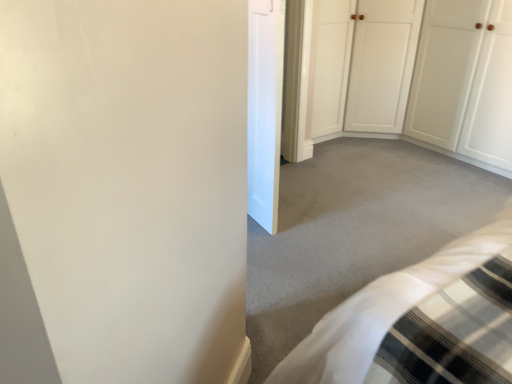
The image size is (512, 384). What do you see at coordinates (265, 109) in the screenshot?
I see `white smooth door at center, which is the second door in right-to-left order` at bounding box center [265, 109].

What is the approximate height of white smooth door at center, which is counted as the first door, starting from the front?

white smooth door at center, which is counted as the first door, starting from the front, is 1.22 meters tall.

You are a GUI agent. You are given a task and a screenshot of the screen. Output one action in this format:
    pyautogui.click(x=<x>, y=<y>)
    Task: Click on the white smooth door at center, the first door when ordered from left to right
    The image size is (512, 384).
    Given the screenshot: What is the action you would take?
    pyautogui.click(x=265, y=109)

Identify the location of white wood door at upper right, which is the first door in right-to-left order. The width and height of the screenshot is (512, 384). (464, 80).

This screenshot has width=512, height=384. What do you see at coordinates (464, 80) in the screenshot?
I see `white wood door at upper right, which is the first door in right-to-left order` at bounding box center [464, 80].

Identify the location of white smooth door at center, the 2th door from the back. Image resolution: width=512 pixels, height=384 pixels. (265, 109).

Visually, is white smooth door at center, which is the second door in right-to-left order, positioned to the left or to the right of white wood door at upper right, the 2th door positioned from the left?

white smooth door at center, which is the second door in right-to-left order, is to the left of white wood door at upper right, the 2th door positioned from the left.

Is white smooth door at center, which is counted as the first door, starting from the front, further to camera compared to white wood door at upper right, which is the first door in right-to-left order?

No, white smooth door at center, which is counted as the first door, starting from the front, is in front of white wood door at upper right, which is the first door in right-to-left order.

Which is in front, point (276, 131) or point (490, 111)?

The point (276, 131) is in front.

From the image's perspective, is white smooth door at center, the first door when ordered from left to right, located above or below white wood door at upper right, which appears as the 2th door when viewed from the front?

Clearly, from the image's perspective, white smooth door at center, the first door when ordered from left to right, is below white wood door at upper right, which appears as the 2th door when viewed from the front.

From a real-world perspective, is white smooth door at center, the first door when ordered from left to right, physically below white wood door at upper right, the 2th door positioned from the left?

No, from a real-world perspective, white smooth door at center, the first door when ordered from left to right, is not under white wood door at upper right, the 2th door positioned from the left.

Considering the sizes of objects white smooth door at center, the first door when ordered from left to right, and white wood door at upper right, the 2th door positioned from the left, in the image provided, who is wider, white smooth door at center, the first door when ordered from left to right, or white wood door at upper right, the 2th door positioned from the left,?

Result: white wood door at upper right, the 2th door positioned from the left, is wider.

Considering the sizes of white smooth door at center, the 2th door from the back, and white wood door at upper right, acting as the 1th door starting from the back, in the image, is white smooth door at center, the 2th door from the back, taller or shorter than white wood door at upper right, acting as the 1th door starting from the back,?

Clearly, white smooth door at center, the 2th door from the back, is taller compared to white wood door at upper right, acting as the 1th door starting from the back.

Is white smooth door at center, the 2th door from the back, bigger than white wood door at upper right, acting as the 1th door starting from the back?

Actually, white smooth door at center, the 2th door from the back, might be smaller than white wood door at upper right, acting as the 1th door starting from the back.

Is white smooth door at center, which is counted as the first door, starting from the front, not within white wood door at upper right, which is the first door in right-to-left order?

Yes, white smooth door at center, which is counted as the first door, starting from the front, is outside of white wood door at upper right, which is the first door in right-to-left order.

Is white smooth door at center, which is the second door in right-to-left order, touching white wood door at upper right, acting as the 1th door starting from the back?

white smooth door at center, which is the second door in right-to-left order, and white wood door at upper right, acting as the 1th door starting from the back, are not in contact.

Is white smooth door at center, which is the second door in right-to-left order, facing towards white wood door at upper right, which appears as the 2th door when viewed from the front?

Yes, white smooth door at center, which is the second door in right-to-left order, is facing white wood door at upper right, which appears as the 2th door when viewed from the front.

What are the coordinates of `door in front of the white wood door at upper right, the 2th door positioned from the left` in the screenshot? It's located at (265, 109).

Between white wood door at upper right, acting as the 1th door starting from the back, and white smooth door at center, which is the second door in right-to-left order, which one appears on the right side from the viewer's perspective?

white wood door at upper right, acting as the 1th door starting from the back.

Which object is further away from the camera taking this photo, white wood door at upper right, which appears as the 2th door when viewed from the front, or white smooth door at center, the first door when ordered from left to right?

white wood door at upper right, which appears as the 2th door when viewed from the front, is further from the camera.

Is point (426, 11) closer to viewer compared to point (283, 10)?

No, it is not.

From the image's perspective, is white wood door at upper right, the 2th door positioned from the left, under white smooth door at center, which is the second door in right-to-left order?

No.

From a real-world perspective, between white wood door at upper right, the 2th door positioned from the left, and white smooth door at center, the first door when ordered from left to right, who is vertically higher?

white smooth door at center, the first door when ordered from left to right, from a real-world perspective.

Is white wood door at upper right, acting as the 1th door starting from the back, thinner than white smooth door at center, which is the second door in right-to-left order?

Incorrect, the width of white wood door at upper right, acting as the 1th door starting from the back, is not less than that of white smooth door at center, which is the second door in right-to-left order.

Considering the relative sizes of white wood door at upper right, acting as the 1th door starting from the back, and white smooth door at center, which is the second door in right-to-left order, in the image provided, is white wood door at upper right, acting as the 1th door starting from the back, shorter than white smooth door at center, which is the second door in right-to-left order,?

Yes.

Considering the sizes of objects white wood door at upper right, acting as the 1th door starting from the back, and white smooth door at center, the 2th door from the back, in the image provided, who is bigger, white wood door at upper right, acting as the 1th door starting from the back, or white smooth door at center, the 2th door from the back,?

With larger size is white wood door at upper right, acting as the 1th door starting from the back.

Is white wood door at upper right, the 2th door positioned from the left, inside the boundaries of white smooth door at center, which is the second door in right-to-left order, or outside?

white wood door at upper right, the 2th door positioned from the left, lies outside white smooth door at center, which is the second door in right-to-left order.

Is white wood door at upper right, which appears as the 2th door when viewed from the front, with white smooth door at center, the first door when ordered from left to right?

No, white wood door at upper right, which appears as the 2th door when viewed from the front, is not making contact with white smooth door at center, the first door when ordered from left to right.

Could you tell me if white wood door at upper right, which is the first door in right-to-left order, is facing white smooth door at center, the 2th door from the back?

Yes, white wood door at upper right, which is the first door in right-to-left order, is aimed at white smooth door at center, the 2th door from the back.

You are a GUI agent. You are given a task and a screenshot of the screen. Output one action in this format:
    pyautogui.click(x=<x>, y=<y>)
    Task: Click on the door in front of the white wood door at upper right, which appears as the 2th door when viewed from the front
    The height and width of the screenshot is (384, 512).
    Given the screenshot: What is the action you would take?
    pyautogui.click(x=265, y=109)

The height and width of the screenshot is (384, 512). I want to click on door that appears below the white wood door at upper right, which appears as the 2th door when viewed from the front (from the image's perspective), so click(265, 109).

Locate an element on the screen. The width and height of the screenshot is (512, 384). door located on the left of white wood door at upper right, the 2th door positioned from the left is located at coordinates (265, 109).